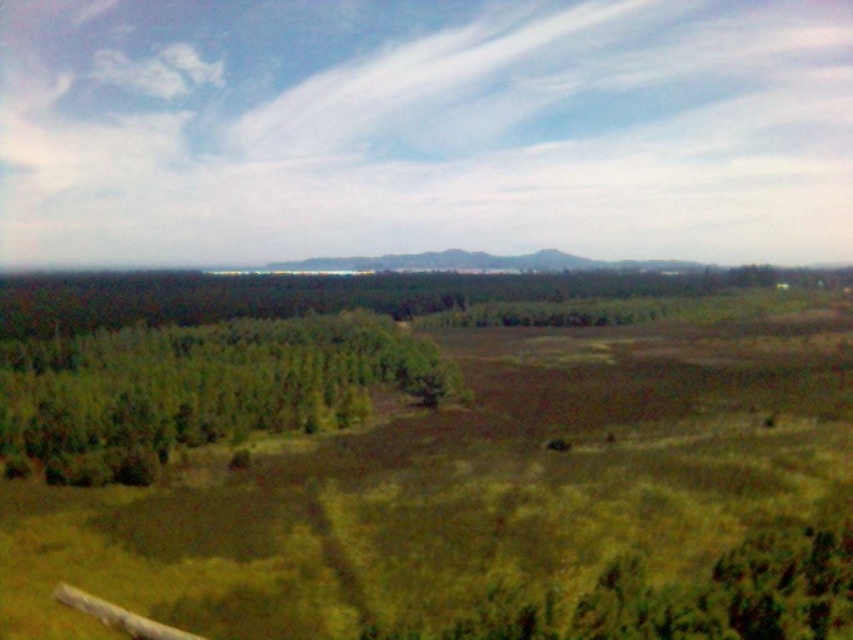
Does green grassy field at center have a lesser width compared to green leafy trees at left?

Incorrect, green grassy field at center's width is not less than green leafy trees at left's.

Does point (479, 534) lie in front of point (386, 324)?

Yes, it is.

Does point (462, 499) lie behind point (134, 422)?

That is False.

This screenshot has height=640, width=853. In order to click on green grassy field at center in this screenshot , I will do `click(430, 474)`.